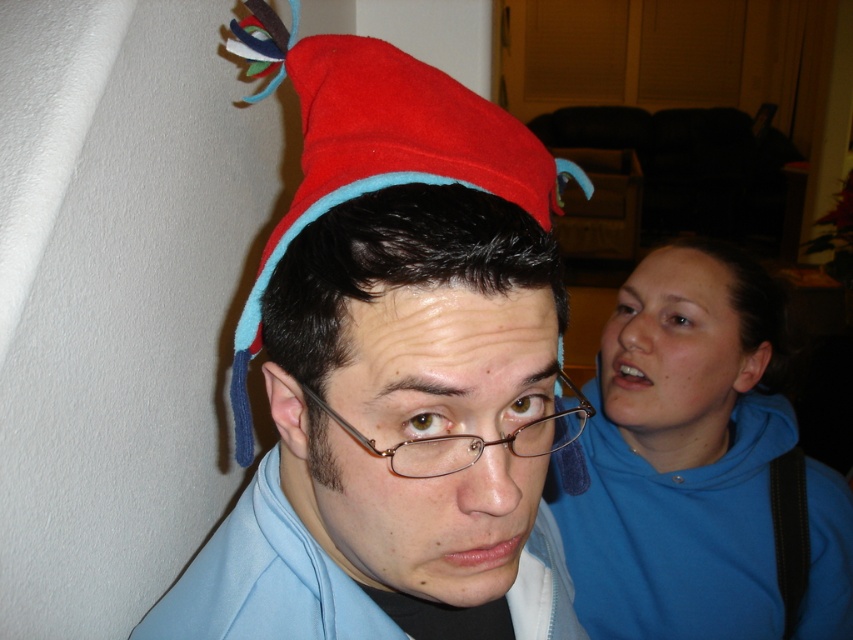
Question: Is red felt hat at center closer to the viewer compared to light blue fleece sweatshirt at center?

Choices:
 (A) no
 (B) yes

Answer: (B)

Question: Can you confirm if blue fleece sweatshirt at upper right is positioned below light blue fleece sweatshirt at center?

Choices:
 (A) no
 (B) yes

Answer: (A)

Question: Which is farther from the blue fleece sweatshirt at upper right?

Choices:
 (A) light blue fleece sweatshirt at center
 (B) red felt hat at center

Answer: (B)

Question: Does blue fleece sweatshirt at upper right have a smaller size compared to red felt hat at center?

Choices:
 (A) yes
 (B) no

Answer: (B)

Question: Which point appears closest to the camera in this image?

Choices:
 (A) (763, 420)
 (B) (511, 147)
 (C) (556, 605)

Answer: (B)

Question: Which of these objects is positioned farthest from the blue fleece sweatshirt at upper right?

Choices:
 (A) red felt hat at center
 (B) light blue fleece sweatshirt at center

Answer: (A)